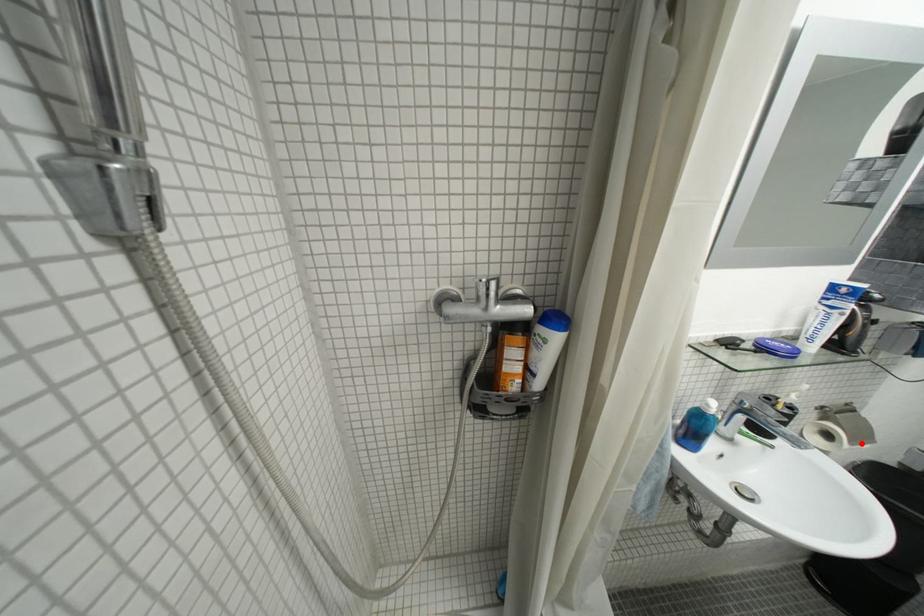
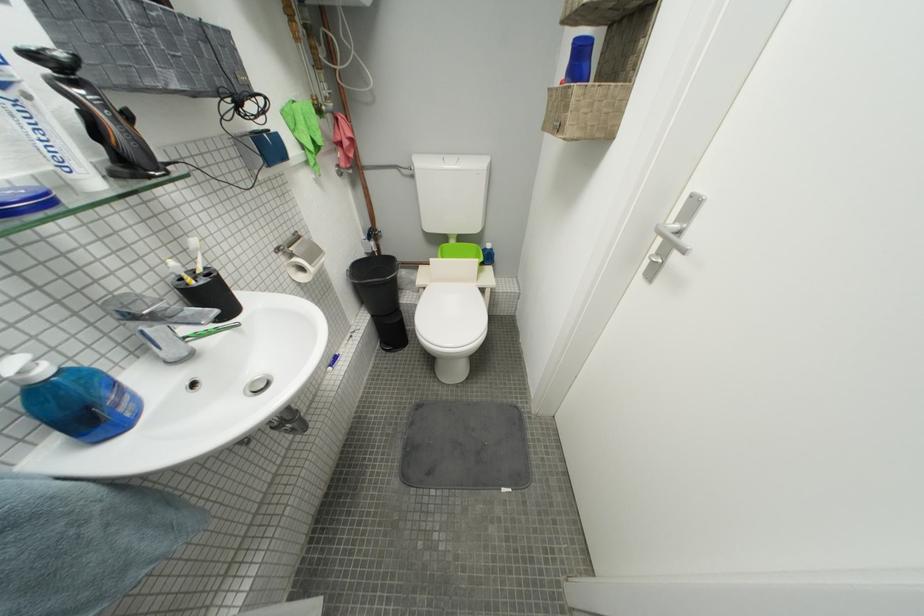
Locate, in the second image, the point that corresponds to the highlighted location in the first image.

(320, 265)